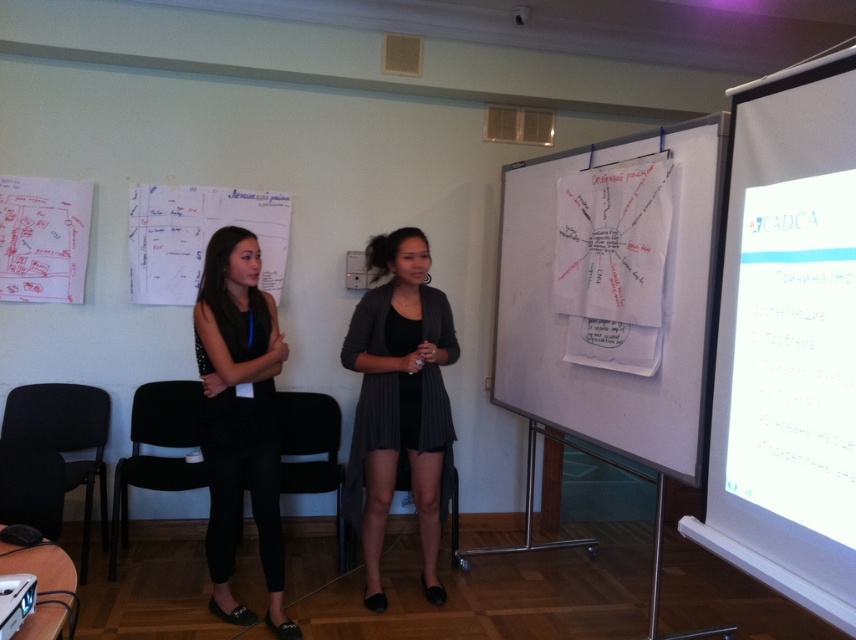
Which is in front, point (278, 600) or point (168, 490)?

Positioned in front is point (278, 600).

Which is below, black matte dress at center or black plastic chair at lower left?

black plastic chair at lower left is lower down.

The height and width of the screenshot is (640, 856). What are the coordinates of `black matte dress at center` in the screenshot? It's located at (241, 419).

Can you confirm if dark gray textured cardigan at center is taller than black fabric chair at lower center?

Yes, dark gray textured cardigan at center is taller than black fabric chair at lower center.

Between dark gray textured cardigan at center and black fabric chair at lower center, which one appears on the right side from the viewer's perspective?

From the viewer's perspective, black fabric chair at lower center appears more on the right side.

Is point (348, 465) more distant than point (450, 513)?

No, it is in front of (450, 513).

Find the location of a particular element. Image resolution: width=856 pixels, height=640 pixels. dark gray textured cardigan at center is located at coordinates (399, 403).

Is point (280, 392) positioned before point (403, 456)?

No.

Between point (336, 509) and point (351, 556), which one is positioned in front?

Point (351, 556)

Which is in front, point (290, 403) or point (401, 474)?

Point (401, 474)

At what (x,y) coordinates should I click in order to perform the action: click on black fabric chair at center. Please return your answer as a coordinate pair (x, y). The height and width of the screenshot is (640, 856). Looking at the image, I should click on (312, 451).